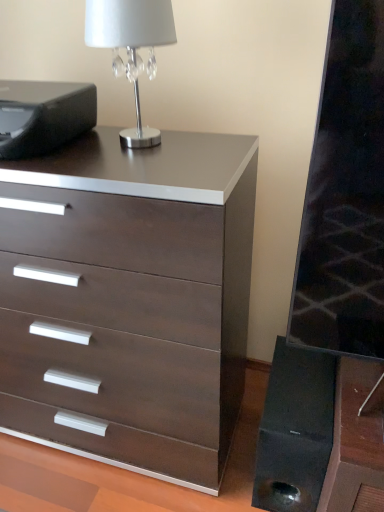
Measure the distance between point (x=169, y=1) and camera.

The depth of point (x=169, y=1) is 36.22 inches.

Describe the element at coordinates (43, 116) in the screenshot. I see `black matte printer at upper left` at that location.

The height and width of the screenshot is (512, 384). What are the coordinates of `black matte speaker at lower right` in the screenshot? It's located at (295, 430).

Can you tell me how much silver metallic table lamp at upper left and black matte printer at upper left differ in facing direction?

There is a 1.53-degree angle between the facing directions of silver metallic table lamp at upper left and black matte printer at upper left.

Who is shorter, silver metallic table lamp at upper left or black matte printer at upper left?

black matte printer at upper left is shorter.

Does point (124, 29) come closer to viewer compared to point (85, 105)?

Yes, it is.

Looking at this image, is dark wood/matte chest of drawers at center bigger than black matte printer at upper left?

A: Yes.

Which point is more distant from viewer, (x=124, y=184) or (x=31, y=95)?

The point (x=31, y=95) is farther.

Would you say dark wood/matte chest of drawers at center is outside black matte printer at upper left?

That's correct, dark wood/matte chest of drawers at center is outside of black matte printer at upper left.

From the image's perspective, is dark wood/matte chest of drawers at center above or below black matte printer at upper left?

From the image's perspective, dark wood/matte chest of drawers at center appears below black matte printer at upper left.

Can you confirm if silver metallic table lamp at upper left is positioned to the left of black matte speaker at lower right?

Yes.

Can you tell me how much silver metallic table lamp at upper left and black matte speaker at lower right differ in facing direction?

2.97 degrees separate the facing orientations of silver metallic table lamp at upper left and black matte speaker at lower right.

Is silver metallic table lamp at upper left taller than black matte speaker at lower right?

No, silver metallic table lamp at upper left is not taller than black matte speaker at lower right.

Measure the distance from silver metallic table lamp at upper left to black matte speaker at lower right.

They are 3.30 feet apart.

Is black matte printer at upper left inside the boundaries of dark wood/matte chest of drawers at center, or outside?

black matte printer at upper left exists outside the volume of dark wood/matte chest of drawers at center.

Can you confirm if black matte printer at upper left is positioned to the right of dark wood/matte chest of drawers at center?

No, black matte printer at upper left is not to the right of dark wood/matte chest of drawers at center.

Considering the sizes of objects black matte printer at upper left and dark wood/matte chest of drawers at center in the image provided, who is shorter, black matte printer at upper left or dark wood/matte chest of drawers at center?

With less height is black matte printer at upper left.

Considering the relative sizes of black matte printer at upper left and dark wood/matte chest of drawers at center in the image provided, is black matte printer at upper left wider than dark wood/matte chest of drawers at center?

No, black matte printer at upper left is not wider than dark wood/matte chest of drawers at center.

Which object is more forward, black matte speaker at lower right or silver metallic table lamp at upper left?

silver metallic table lamp at upper left is closer to the camera.

From the image's perspective, is black matte speaker at lower right on top of silver metallic table lamp at upper left?

No, from the image's perspective, black matte speaker at lower right is not above silver metallic table lamp at upper left.

Can you confirm if black matte speaker at lower right is taller than silver metallic table lamp at upper left?

Indeed, black matte speaker at lower right has a greater height compared to silver metallic table lamp at upper left.

Can you confirm if black matte printer at upper left is taller than silver metallic table lamp at upper left?

No.

From a real-world perspective, which is physically above, black matte printer at upper left or silver metallic table lamp at upper left?

silver metallic table lamp at upper left is physically above.

How far apart are black matte printer at upper left and silver metallic table lamp at upper left?

A distance of 9.97 inches exists between black matte printer at upper left and silver metallic table lamp at upper left.

Looking at this image, does black matte printer at upper left have a smaller size compared to silver metallic table lamp at upper left?

No, black matte printer at upper left is not smaller than silver metallic table lamp at upper left.

Does point (106, 25) come closer to viewer compared to point (215, 411)?

Yes, point (106, 25) is in front of point (215, 411).

Would you say silver metallic table lamp at upper left is a long distance from dark wood/matte chest of drawers at center?

No.

Considering the relative positions of silver metallic table lamp at upper left and dark wood/matte chest of drawers at center in the image provided, is silver metallic table lamp at upper left to the left or to the right of dark wood/matte chest of drawers at center?

silver metallic table lamp at upper left is positioned on dark wood/matte chest of drawers at center's right side.

Which of these two, silver metallic table lamp at upper left or dark wood/matte chest of drawers at center, is thinner?

silver metallic table lamp at upper left is thinner.

Identify the location of table lamp on the right of black matte printer at upper left. The width and height of the screenshot is (384, 512). (131, 47).

The height and width of the screenshot is (512, 384). I want to click on printer behind the dark wood/matte chest of drawers at center, so click(43, 116).

Looking at the image, which one is located further to silver metallic table lamp at upper left, dark wood/matte chest of drawers at center or black matte speaker at lower right?

black matte speaker at lower right lies further to silver metallic table lamp at upper left than the other object.

Based on their spatial positions, is silver metallic table lamp at upper left or black matte printer at upper left further from dark wood/matte chest of drawers at center?

Based on the image, silver metallic table lamp at upper left appears to be further to dark wood/matte chest of drawers at center.

From the picture: Considering their positions, is black matte printer at upper left positioned closer to dark wood/matte chest of drawers at center than black matte speaker at lower right?

The object closer to dark wood/matte chest of drawers at center is black matte speaker at lower right.

Estimate the real-world distances between objects in this image. Which object is closer to black matte printer at upper left, silver metallic table lamp at upper left or black matte speaker at lower right?

silver metallic table lamp at upper left lies closer to black matte printer at upper left than the other object.

Considering their positions, is black matte printer at upper left positioned further to black matte speaker at lower right than silver metallic table lamp at upper left?

Based on the image, silver metallic table lamp at upper left appears to be further to black matte speaker at lower right.

Estimate the real-world distances between objects in this image. Which object is further from black matte speaker at lower right, dark wood/matte chest of drawers at center or black matte printer at upper left?

black matte printer at upper left is further to black matte speaker at lower right.

Looking at this image, considering their positions, is black matte speaker at lower right positioned further to dark wood/matte chest of drawers at center than black matte printer at upper left?

Based on the image, black matte printer at upper left appears to be further to dark wood/matte chest of drawers at center.

Which object lies nearer to the anchor point silver metallic table lamp at upper left, black matte speaker at lower right or black matte printer at upper left?

Based on the image, black matte printer at upper left appears to be nearer to silver metallic table lamp at upper left.

Find the location of a particular element. The height and width of the screenshot is (512, 384). printer between silver metallic table lamp at upper left and black matte speaker at lower right from top to bottom is located at coordinates (43, 116).

At what (x,y) coordinates should I click in order to perform the action: click on the chest of drawers that lies between silver metallic table lamp at upper left and black matte speaker at lower right from top to bottom. Please return your answer as a coordinate pair (x, y). The height and width of the screenshot is (512, 384). Looking at the image, I should click on (129, 298).

At what (x,y) coordinates should I click in order to perform the action: click on printer between silver metallic table lamp at upper left and dark wood/matte chest of drawers at center in the up-down direction. Please return your answer as a coordinate pair (x, y). The height and width of the screenshot is (512, 384). Looking at the image, I should click on (43, 116).

Locate an element on the screen. the chest of drawers that lies between black matte printer at upper left and black matte speaker at lower right from top to bottom is located at coordinates (129, 298).